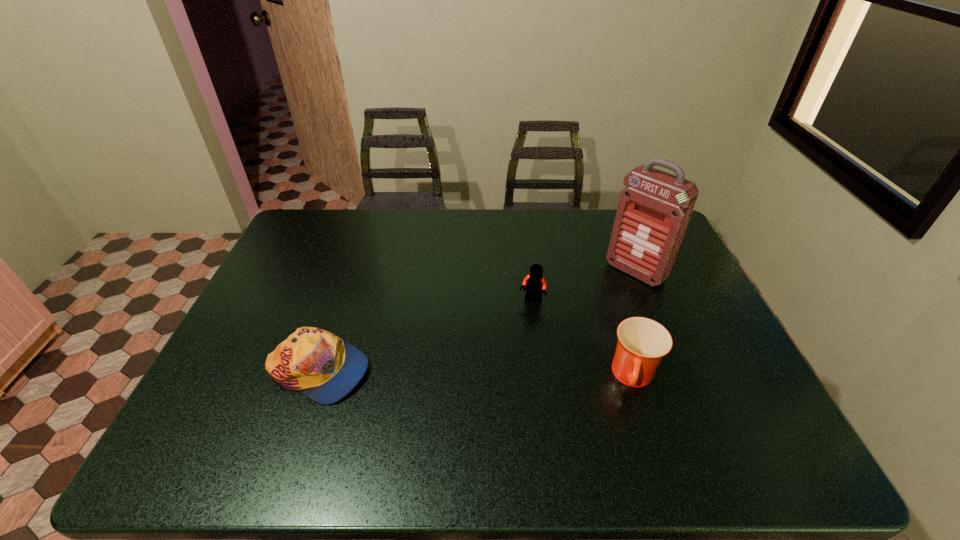
The width and height of the screenshot is (960, 540). What are the coordinates of `the leftmost object` in the screenshot? It's located at (325, 368).

Image resolution: width=960 pixels, height=540 pixels. In order to click on cap in this screenshot , I will do `click(325, 368)`.

Locate an element on the screen. The width and height of the screenshot is (960, 540). cup is located at coordinates (642, 342).

At what (x,y) coordinates should I click in order to perform the action: click on Lego. Please return your answer as a coordinate pair (x, y). The height and width of the screenshot is (540, 960). Looking at the image, I should click on (535, 284).

This screenshot has width=960, height=540. In order to click on the second object from left to right in this screenshot , I will do `click(535, 284)`.

The height and width of the screenshot is (540, 960). I want to click on the tallest object, so click(x=653, y=212).

At what (x,y) coordinates should I click in order to perform the action: click on the first-aid kit. Please return your answer as a coordinate pair (x, y). This screenshot has width=960, height=540. Looking at the image, I should click on (653, 212).

In order to click on free space located on the bill of the cap in this screenshot , I will do `click(505, 371)`.

Image resolution: width=960 pixels, height=540 pixels. I want to click on free spot located 0.080m on the back of the cup, so click(618, 329).

Identify the location of free space located on the front-facing side of the Lego. pyautogui.click(x=518, y=324).